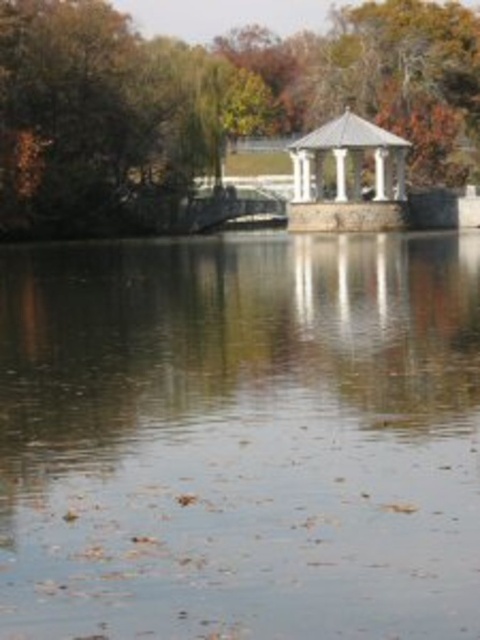
Is clear water at center thinner than white stone gazebo at center?

Incorrect, clear water at center's width is not less than white stone gazebo at center's.

Does clear water at center come in front of white stone gazebo at center?

Yes, it is in front of white stone gazebo at center.

Which is in front, point (165, 419) or point (404, 196)?

Point (165, 419)

Find the location of a particular element. The image size is (480, 640). clear water at center is located at coordinates click(240, 436).

Between clear water at center and green leafy tree at upper left, which one appears on the right side from the viewer's perspective?

From the viewer's perspective, green leafy tree at upper left appears more on the right side.

Does clear water at center appear on the left side of green leafy tree at upper left?

Indeed, clear water at center is positioned on the left side of green leafy tree at upper left.

Identify the location of clear water at center. (240, 436).

Where is `green leafy tree at upper left`? green leafy tree at upper left is located at coordinates (204, 102).

Is green leafy tree at upper left smaller than white stone gazebo at center?

Incorrect, green leafy tree at upper left is not smaller in size than white stone gazebo at center.

The image size is (480, 640). What do you see at coordinates (204, 102) in the screenshot?
I see `green leafy tree at upper left` at bounding box center [204, 102].

Where is `green leafy tree at upper left`? green leafy tree at upper left is located at coordinates (204, 102).